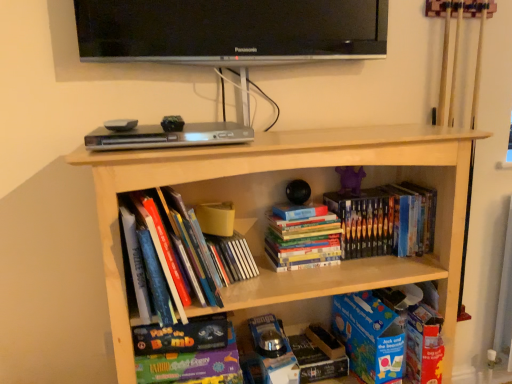
This screenshot has width=512, height=384. What do you see at coordinates (386, 220) in the screenshot?
I see `hardcover books at center, the 4th book in the left-to-right sequence` at bounding box center [386, 220].

What is the approximate width of purple matte toy at center?

It is 2.28 inches.

I want to click on blue cardboard book at lower right, so click(369, 337).

At what (x,y) coordinates should I click in order to perform the action: click on black glossy television at upper center. Please return your answer as a coordinate pair (x, y). This screenshot has height=384, width=512. Looking at the image, I should click on (230, 31).

Describe the element at coordinates (181, 245) in the screenshot. I see `hardcover books at center, which is the 4th book in right-to-left order` at that location.

You are a GUI agent. You are given a task and a screenshot of the screen. Output one action in this format:
    pyautogui.click(x=<x>, y=<y>)
    Task: Click on the light wood bookcase at center
    
    Given the screenshot: What is the action you would take?
    pyautogui.click(x=293, y=169)

At what (x,y) coordinates should I click in order to perform the action: click on hardcover books at center, the 4th book in the left-to-right sequence. Please return your answer as a coordinate pair (x, y). The height and width of the screenshot is (384, 512). Looking at the image, I should click on (386, 220).

In order to click on bookcase that appears in front of the hardcover books at center, the 4th book in the left-to-right sequence in this screenshot , I will do `click(293, 169)`.

Is light wood bookcase at center touching hardcover books at center, the 4th book in the left-to-right sequence?

No, light wood bookcase at center is not in contact with hardcover books at center, the 4th book in the left-to-right sequence.

In the image, is light wood bookcase at center positioned in front of or behind hardcover books at center, arranged as the first book when viewed from the right?

Clearly, light wood bookcase at center is in front of hardcover books at center, arranged as the first book when viewed from the right.

From a real-world perspective, is light wood bookcase at center under hardcover books at center, arranged as the first book when viewed from the right?

Yes, from a real-world perspective, light wood bookcase at center is under hardcover books at center, arranged as the first book when viewed from the right.

Considering the relative positions of blue cardboard book at lower right and matte board game at lower center, which is the 3th book in right-to-left order, in the image provided, is blue cardboard book at lower right to the right of matte board game at lower center, which is the 3th book in right-to-left order, from the viewer's perspective?

Correct, you'll find blue cardboard book at lower right to the right of matte board game at lower center, which is the 3th book in right-to-left order.

Is blue cardboard book at lower right oriented towards matte board game at lower center, the 2th book from the left?

No, blue cardboard book at lower right is not oriented towards matte board game at lower center, the 2th book from the left.

Can you confirm if blue cardboard book at lower right is taller than matte board game at lower center, the 2th book from the left?

Correct, blue cardboard book at lower right is much taller as matte board game at lower center, the 2th book from the left.

Which object is more forward, purple matte toy at center or hardcover books at center, which is the first book from left to right?

hardcover books at center, which is the first book from left to right, is in front.

Does purple matte toy at center have a greater height compared to hardcover books at center, which is the first book from left to right?

Incorrect, the height of purple matte toy at center is not larger of that of hardcover books at center, which is the first book from left to right.

Which is less distant, (x=340, y=178) or (x=173, y=242)?

Point (x=340, y=178) is farther from the camera than point (x=173, y=242).

Is purple matte toy at center facing towards hardcover books at center, which is the 4th book in right-to-left order?

No, purple matte toy at center does not turn towards hardcover books at center, which is the 4th book in right-to-left order.

How far apart are hardcover books at center, arranged as the first book when viewed from the right, and black glossy television at upper center?

They are 22.08 inches apart.

Considering the positions of point (361, 225) and point (336, 25), is point (361, 225) closer or farther from the camera than point (336, 25)?

Point (361, 225).

Looking at this image, which of these two, hardcover books at center, the 4th book in the left-to-right sequence, or black glossy television at upper center, is bigger?

black glossy television at upper center.

Consider the image. From the image's perspective, who appears lower, hardcover books at center, which is the 4th book in right-to-left order, or black glossy television at upper center?

hardcover books at center, which is the 4th book in right-to-left order, is shown below in the image.

Does hardcover books at center, which is the first book from left to right, have a lesser height compared to black glossy television at upper center?

Incorrect, the height of hardcover books at center, which is the first book from left to right, does not fall short of that of black glossy television at upper center.

Is black glossy television at upper center in contact with light wood bookcase at center?

No, black glossy television at upper center is not beside light wood bookcase at center.

Measure the distance between black glossy television at upper center and light wood bookcase at center.

17.81 inches.

From the image's perspective, which one is positioned higher, black glossy television at upper center or light wood bookcase at center?

black glossy television at upper center.

Considering the sizes of black glossy television at upper center and light wood bookcase at center in the image, is black glossy television at upper center bigger or smaller than light wood bookcase at center?

Considering their sizes, black glossy television at upper center takes up less space than light wood bookcase at center.

Between hardcover books at center, which is the 4th book in right-to-left order, and light wood bookcase at center, which one has more height?

light wood bookcase at center is taller.

From a real-world perspective, is hardcover books at center, which is the 4th book in right-to-left order, on top of light wood bookcase at center?

Indeed, from a real-world perspective, hardcover books at center, which is the 4th book in right-to-left order, stands above light wood bookcase at center.

At what (x,y) coordinates should I click in order to perform the action: click on the 2nd book above the light wood bookcase at center (from a real-world perspective). Please return your answer as a coordinate pair (x, y). Image resolution: width=512 pixels, height=384 pixels. Looking at the image, I should click on (386, 220).

Locate an element on the screen. This screenshot has width=512, height=384. the 1st book in front of the blue cardboard book at lower right is located at coordinates (192, 365).

Which object lies nearer to the anchor point blue cardboard book at lower right, hardcover books at center, arranged as the first book when viewed from the right, or light wood bookcase at center?

hardcover books at center, arranged as the first book when viewed from the right, is closer to blue cardboard book at lower right.

Which object lies further to the anchor point blue cardboard book at lower right, black glossy television at upper center or hardcover books at center, arranged as the first book when viewed from the right?

black glossy television at upper center.

Consider the image. Estimate the real-world distances between objects in this image. Which object is closer to light wood bookcase at center, hardcover books at center, the third book in the left-to-right sequence, or black glossy television at upper center?

hardcover books at center, the third book in the left-to-right sequence, lies closer to light wood bookcase at center than the other object.

Considering their positions, is black glossy television at upper center positioned closer to hardcover books at center, the 4th book in the left-to-right sequence, than light wood bookcase at center?

light wood bookcase at center.

Estimate the real-world distances between objects in this image. Which object is closer to purple matte toy at center, hardcover books at center, arranged as the second book when viewed from the right, or hardcover books at center, which is the 4th book in right-to-left order?

Based on the image, hardcover books at center, arranged as the second book when viewed from the right, appears to be nearer to purple matte toy at center.

Estimate the real-world distances between objects in this image. Which object is further from matte board game at lower center, which is the 3th book in right-to-left order, purple matte toy at center or hardcover books at center, arranged as the first book when viewed from the right?

purple matte toy at center is positioned further to the anchor matte board game at lower center, which is the 3th book in right-to-left order.

Based on their spatial positions, is purple matte toy at center or blue cardboard book at lower right closer to light wood bookcase at center?

blue cardboard book at lower right lies closer to light wood bookcase at center than the other object.

From the image, which object appears to be farther from black glossy television at upper center, blue cardboard book at lower right or hardcover books at center, arranged as the second book when viewed from the right?

Among the two, blue cardboard book at lower right is located further to black glossy television at upper center.

What are the coordinates of `bookcase between black glossy television at upper center and blue cardboard book at lower right in the up-down direction` in the screenshot? It's located at (293, 169).

This screenshot has height=384, width=512. What are the coordinates of `toy between matte board game at lower center, which is the 3th book in right-to-left order, and hardcover books at center, the 4th book in the left-to-right sequence, from left to right` in the screenshot? It's located at (350, 180).

What are the coordinates of `bookcase between hardcover books at center, which is the 4th book in right-to-left order, and matte board game at lower center, the 2th book from the left, vertically` in the screenshot? It's located at (293, 169).

Find the location of a particular element. book situated between matte board game at lower center, which is the 3th book in right-to-left order, and blue cardboard book at lower right from left to right is located at coordinates (303, 238).